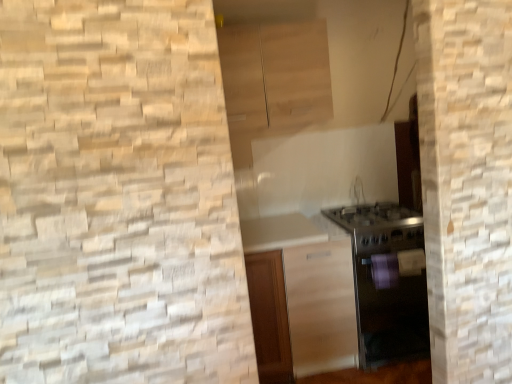
At what (x,y) coordinates should I click in order to perform the action: click on satin wood cabinet at center, placed as the first cabinetry when sorted from bottom to top. Please return your answer as a coordinate pair (x, y). This screenshot has width=512, height=384. Looking at the image, I should click on (303, 310).

This screenshot has height=384, width=512. What are the coordinates of `satin wood cabinet at center, placed as the first cabinetry when sorted from bottom to top` in the screenshot? It's located at [x=303, y=310].

Who is taller, satin wood cabinet at center, placed as the first cabinetry when sorted from bottom to top, or satin silver oven at lower right?

satin wood cabinet at center, placed as the first cabinetry when sorted from bottom to top, is taller.

Is satin wood cabinet at center, placed as the first cabinetry when sorted from bottom to top, inside the boundaries of satin silver oven at lower right, or outside?

The correct answer is: outside.

Based on their sizes in the image, would you say satin wood cabinet at center, placed as the first cabinetry when sorted from bottom to top, is bigger or smaller than satin silver oven at lower right?

Clearly, satin wood cabinet at center, placed as the first cabinetry when sorted from bottom to top, is smaller in size than satin silver oven at lower right.

Are satin wood cabinet at center, marked as the second cabinetry in a top-to-bottom arrangement, and satin silver oven at lower right located far from each other?

satin wood cabinet at center, marked as the second cabinetry in a top-to-bottom arrangement, is actually quite close to satin silver oven at lower right.

Consider the image. From a real-world perspective, is satin silver oven at lower right above or below light wood cabinet at upper center, which appears as the second cabinetry when ordered from the bottom?

Clearly, from a real-world perspective, satin silver oven at lower right is below light wood cabinet at upper center, which appears as the second cabinetry when ordered from the bottom.

What's the angular difference between satin silver oven at lower right and light wood cabinet at upper center, acting as the first cabinetry starting from the top,'s facing directions?

The angular difference between satin silver oven at lower right and light wood cabinet at upper center, acting as the first cabinetry starting from the top, is 0.75 degrees.

Which object is closer to the camera, satin silver oven at lower right or light wood cabinet at upper center, which appears as the second cabinetry when ordered from the bottom?

satin silver oven at lower right is more forward.

Is satin silver oven at lower right taller or shorter than light wood cabinet at upper center, acting as the first cabinetry starting from the top?

Clearly, satin silver oven at lower right is taller compared to light wood cabinet at upper center, acting as the first cabinetry starting from the top.

Can you confirm if satin wood cabinet at center, marked as the second cabinetry in a top-to-bottom arrangement, is bigger than light wood cabinet at upper center, which appears as the second cabinetry when ordered from the bottom?

Correct, satin wood cabinet at center, marked as the second cabinetry in a top-to-bottom arrangement, is larger in size than light wood cabinet at upper center, which appears as the second cabinetry when ordered from the bottom.

From the image's perspective, which one is positioned lower, satin wood cabinet at center, placed as the first cabinetry when sorted from bottom to top, or light wood cabinet at upper center, which appears as the second cabinetry when ordered from the bottom?

satin wood cabinet at center, placed as the first cabinetry when sorted from bottom to top, from the image's perspective.

Would you say satin wood cabinet at center, placed as the first cabinetry when sorted from bottom to top, is outside light wood cabinet at upper center, acting as the first cabinetry starting from the top?

Yes.

From their relative heights in the image, would you say light wood cabinet at upper center, acting as the first cabinetry starting from the top, is taller or shorter than satin silver oven at lower right?

In the image, light wood cabinet at upper center, acting as the first cabinetry starting from the top, appears to be shorter than satin silver oven at lower right.

Is light wood cabinet at upper center, acting as the first cabinetry starting from the top, behind satin silver oven at lower right?

Yes, light wood cabinet at upper center, acting as the first cabinetry starting from the top, is further from the camera.

Are light wood cabinet at upper center, which appears as the second cabinetry when ordered from the bottom, and satin silver oven at lower right far apart?

That's right, there is a large distance between light wood cabinet at upper center, which appears as the second cabinetry when ordered from the bottom, and satin silver oven at lower right.

Is satin silver oven at lower right far from satin wood cabinet at center, marked as the second cabinetry in a top-to-bottom arrangement?

No, there isn't a large distance between satin silver oven at lower right and satin wood cabinet at center, marked as the second cabinetry in a top-to-bottom arrangement.

In the scene shown: Between satin silver oven at lower right and satin wood cabinet at center, marked as the second cabinetry in a top-to-bottom arrangement, which one has more height?

With more height is satin wood cabinet at center, marked as the second cabinetry in a top-to-bottom arrangement.

In the image, is satin silver oven at lower right positioned in front of or behind satin wood cabinet at center, marked as the second cabinetry in a top-to-bottom arrangement?

In the image, satin silver oven at lower right appears behind satin wood cabinet at center, marked as the second cabinetry in a top-to-bottom arrangement.

Locate an element on the screen. oven on the right of satin wood cabinet at center, marked as the second cabinetry in a top-to-bottom arrangement is located at coordinates (386, 281).

Is light wood cabinet at upper center, acting as the first cabinetry starting from the top, smaller than satin wood cabinet at center, marked as the second cabinetry in a top-to-bottom arrangement?

Indeed, light wood cabinet at upper center, acting as the first cabinetry starting from the top, has a smaller size compared to satin wood cabinet at center, marked as the second cabinetry in a top-to-bottom arrangement.

Choose the correct answer: Is light wood cabinet at upper center, acting as the first cabinetry starting from the top, inside satin wood cabinet at center, marked as the second cabinetry in a top-to-bottom arrangement, or outside it?

light wood cabinet at upper center, acting as the first cabinetry starting from the top, cannot be found inside satin wood cabinet at center, marked as the second cabinetry in a top-to-bottom arrangement.

Does light wood cabinet at upper center, acting as the first cabinetry starting from the top, turn towards satin wood cabinet at center, placed as the first cabinetry when sorted from bottom to top?

No, light wood cabinet at upper center, acting as the first cabinetry starting from the top, is not facing towards satin wood cabinet at center, placed as the first cabinetry when sorted from bottom to top.

Locate an element on the screen. the 1st cabinetry above the satin silver oven at lower right (from a real-world perspective) is located at coordinates click(x=303, y=310).

You are a GUI agent. You are given a task and a screenshot of the screen. Output one action in this format:
    pyautogui.click(x=<x>, y=<y>)
    Task: Click on the oven on the right of the light wood cabinet at upper center, which appears as the second cabinetry when ordered from the bottom
    
    Given the screenshot: What is the action you would take?
    pyautogui.click(x=386, y=281)

When comparing their distances from light wood cabinet at upper center, acting as the first cabinetry starting from the top, does satin silver oven at lower right or satin wood cabinet at center, placed as the first cabinetry when sorted from bottom to top, seem closer?

satin silver oven at lower right lies closer to light wood cabinet at upper center, acting as the first cabinetry starting from the top, than the other object.

Considering their positions, is satin wood cabinet at center, placed as the first cabinetry when sorted from bottom to top, positioned further to light wood cabinet at upper center, acting as the first cabinetry starting from the top, than satin silver oven at lower right?

Based on the image, satin wood cabinet at center, placed as the first cabinetry when sorted from bottom to top, appears to be further to light wood cabinet at upper center, acting as the first cabinetry starting from the top.

Based on their spatial positions, is light wood cabinet at upper center, acting as the first cabinetry starting from the top, or satin silver oven at lower right closer to satin wood cabinet at center, marked as the second cabinetry in a top-to-bottom arrangement?

Among the two, satin silver oven at lower right is located nearer to satin wood cabinet at center, marked as the second cabinetry in a top-to-bottom arrangement.

Which object lies further to the anchor point satin silver oven at lower right, satin wood cabinet at center, placed as the first cabinetry when sorted from bottom to top, or light wood cabinet at upper center, acting as the first cabinetry starting from the top?

Based on the image, light wood cabinet at upper center, acting as the first cabinetry starting from the top, appears to be further to satin silver oven at lower right.

Based on their spatial positions, is light wood cabinet at upper center, which appears as the second cabinetry when ordered from the bottom, or satin wood cabinet at center, placed as the first cabinetry when sorted from bottom to top, further from satin silver oven at lower right?

The object further to satin silver oven at lower right is light wood cabinet at upper center, which appears as the second cabinetry when ordered from the bottom.

Looking at the image, which one is located closer to satin wood cabinet at center, marked as the second cabinetry in a top-to-bottom arrangement, satin silver oven at lower right or light wood cabinet at upper center, which appears as the second cabinetry when ordered from the bottom?

satin silver oven at lower right lies closer to satin wood cabinet at center, marked as the second cabinetry in a top-to-bottom arrangement, than the other object.

Locate an element on the screen. The width and height of the screenshot is (512, 384). cabinetry between light wood cabinet at upper center, acting as the first cabinetry starting from the top, and satin silver oven at lower right from top to bottom is located at coordinates (303, 310).